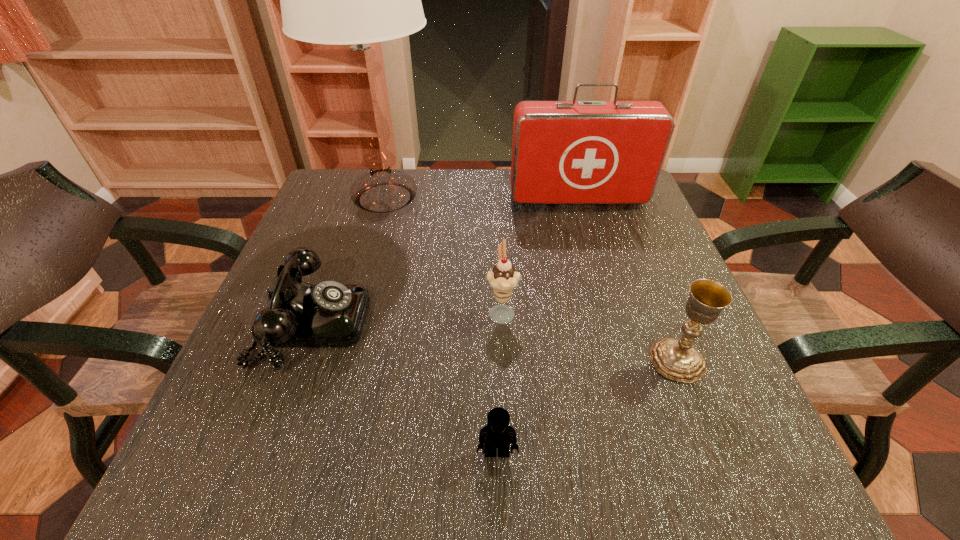
The width and height of the screenshot is (960, 540). I want to click on object at the far right corner, so click(x=563, y=152).

Find the location of a particular element. This screenshot has height=540, width=960. free space at the far edge is located at coordinates (495, 171).

This screenshot has width=960, height=540. What are the coordinates of `free spot at the near edge of the desktop` in the screenshot? It's located at (605, 436).

The height and width of the screenshot is (540, 960). I want to click on vacant space at the left edge of the desktop, so click(x=318, y=276).

You are a GUI agent. You are given a task and a screenshot of the screen. Output one action in this format:
    pyautogui.click(x=<x>, y=<y>)
    Task: Click on the vacant space at the right edge of the desktop
    
    Given the screenshot: What is the action you would take?
    pyautogui.click(x=597, y=221)

At what (x,y) coordinates should I click in order to perform the action: click on vacant region at the near left corner of the desktop. Please return your answer as a coordinate pair (x, y). The height and width of the screenshot is (540, 960). Looking at the image, I should click on 250,462.

Locate an element on the screen. Image resolution: width=960 pixels, height=540 pixels. vacant region at the far right corner of the desktop is located at coordinates (645, 206).

Locate an element on the screen. The image size is (960, 540). free space between the table lamp and the icecream is located at coordinates (444, 254).

Locate an element on the screen. vacant point located between the icecream and the tallest object is located at coordinates (444, 254).

You are a GUI agent. You are given a task and a screenshot of the screen. Output one action in this format:
    pyautogui.click(x=<x>, y=<y>)
    Task: Click on the vacant space that's between the telephone and the shortest object
    
    Given the screenshot: What is the action you would take?
    pyautogui.click(x=404, y=387)